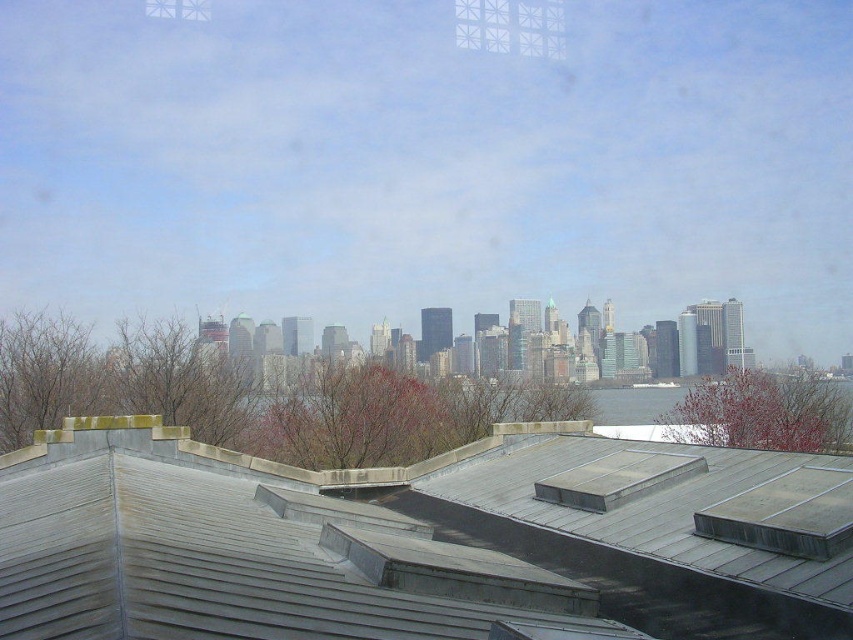
Which is above, gray metal roof at center or white textured window at upper center?

Positioned higher is white textured window at upper center.

Does gray metal roof at center have a smaller size compared to white textured window at upper center?

Yes.

Does point (62, 572) come in front of point (456, 20)?

Yes, point (62, 572) is in front of point (456, 20).

You are a GUI agent. You are given a task and a screenshot of the screen. Output one action in this format:
    pyautogui.click(x=<x>, y=<y>)
    Task: Click on the gray metal roof at center
    
    Given the screenshot: What is the action you would take?
    pyautogui.click(x=421, y=540)